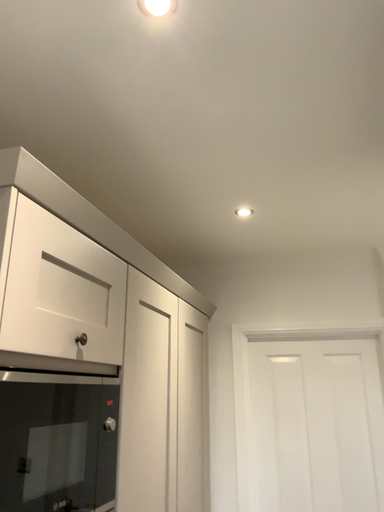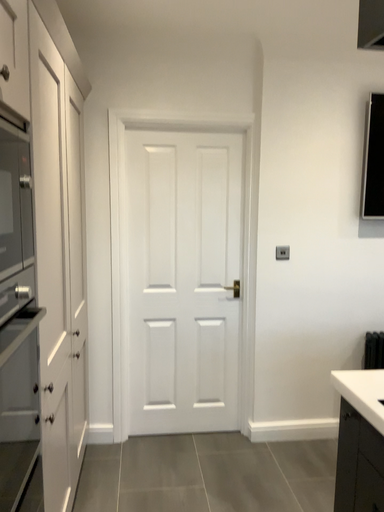
Question: Which way did the camera rotate in the video?

Choices:
 (A) rotated left
 (B) rotated right

Answer: (B)